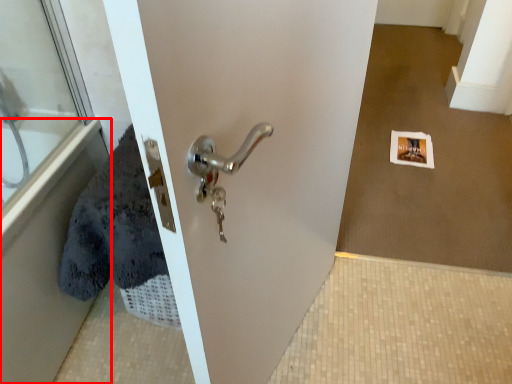
Question: Observing the image, what is the correct spatial positioning of bath (annotated by the red box) in reference to glass door?

Choices:
 (A) left
 (B) right

Answer: (A)